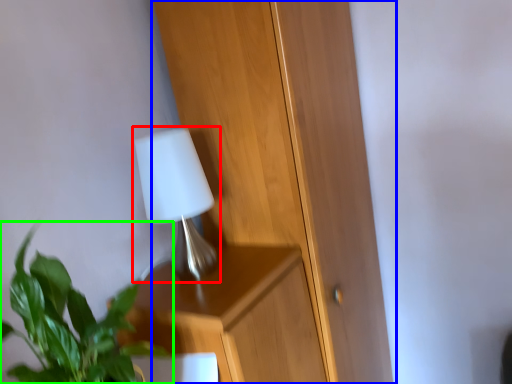
Question: Which object is the farthest from lamp (highlighted by a red box)? Choose among these: dresser (highlighted by a blue box) or houseplant (highlighted by a green box).

Choices:
 (A) dresser
 (B) houseplant

Answer: (B)